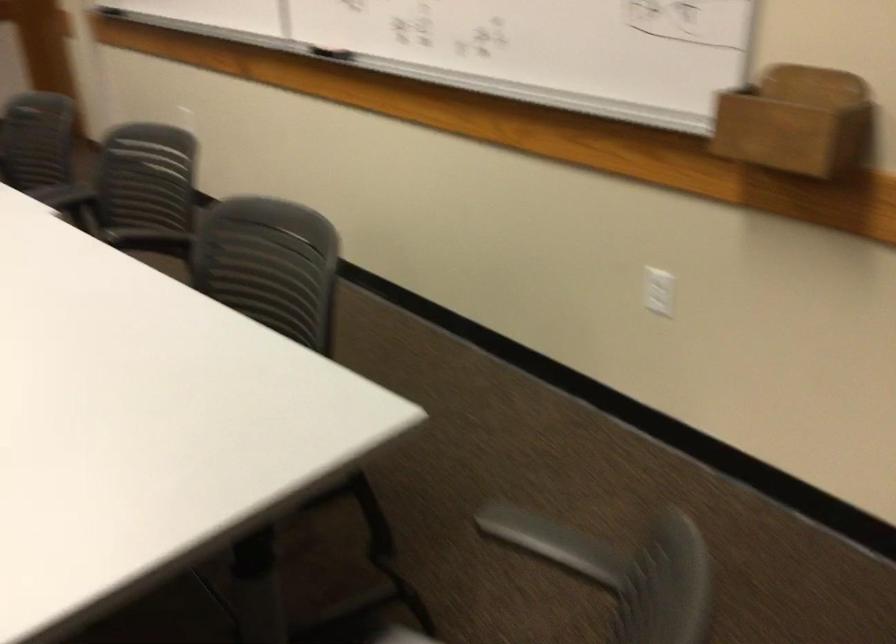
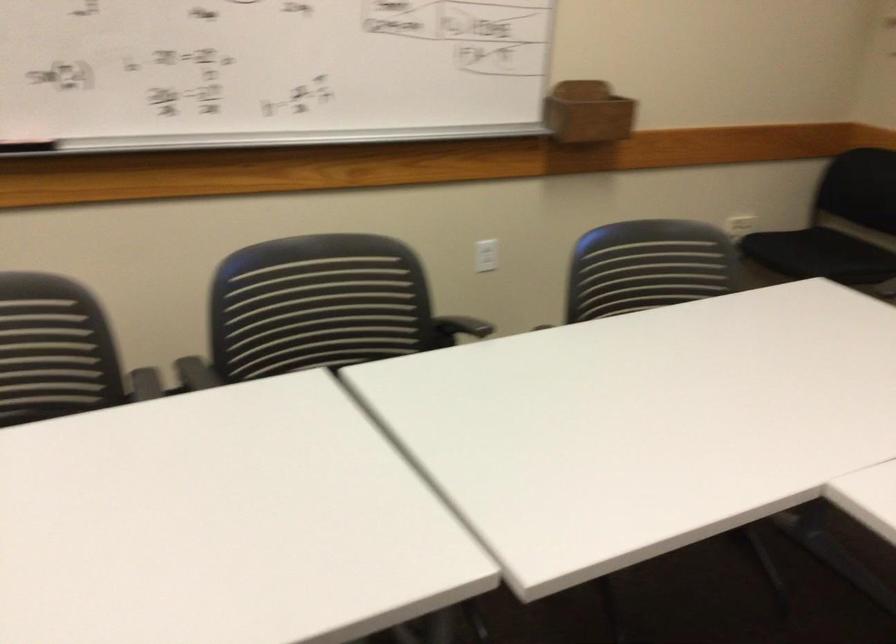
Locate, in the second image, the point that corresponds to [192,194] in the first image.

(317, 308)